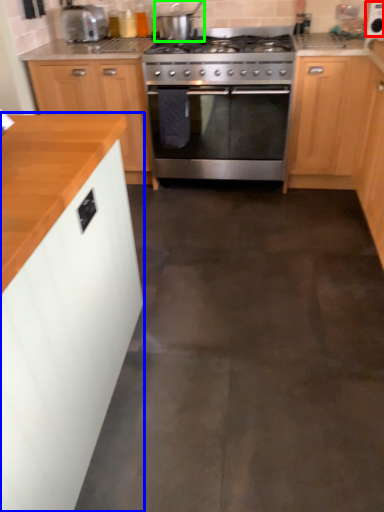
Question: Which is farther away from appliance (highlighted by a red box)? cabinetry (highlighted by a blue box) or appliance (highlighted by a green box)?

Choices:
 (A) cabinetry
 (B) appliance

Answer: (A)